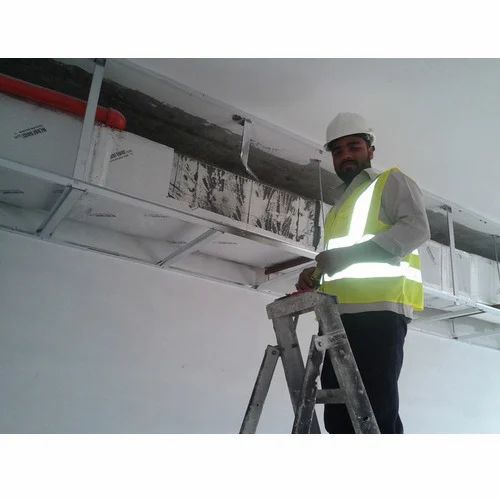
Image resolution: width=500 pixels, height=500 pixels. I want to click on ladder, so click(349, 373).